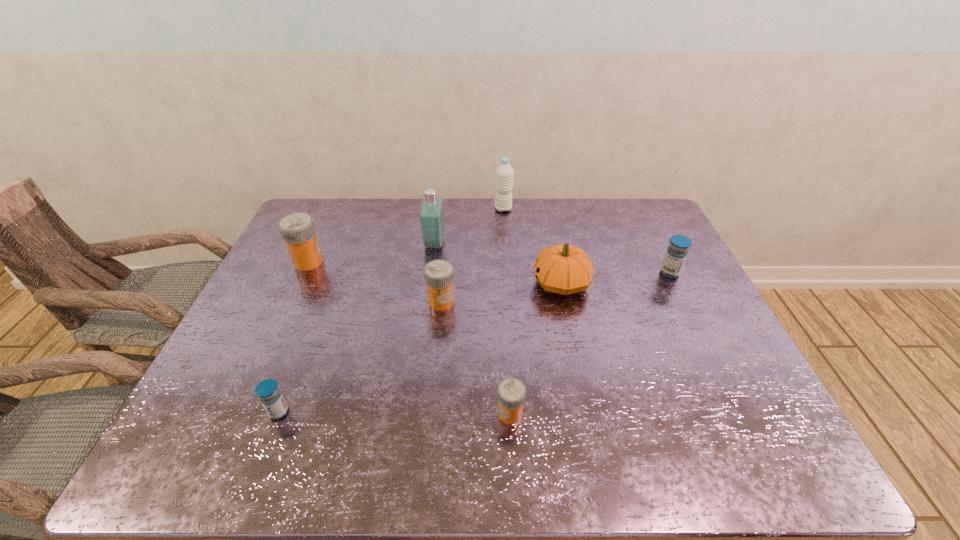
Locate an element on the screen. The height and width of the screenshot is (540, 960). the third nearest medicine is located at coordinates 439,274.

Locate an element on the screen. The height and width of the screenshot is (540, 960). the smaller blue medicine is located at coordinates (268, 392).

Locate an element on the screen. The width and height of the screenshot is (960, 540). the nearer blue medicine is located at coordinates (268, 392).

The image size is (960, 540). In order to click on the rightmost orange medicine in this screenshot , I will do `click(511, 391)`.

Find the location of a particular element. This screenshot has width=960, height=540. the smallest orange medicine is located at coordinates (511, 391).

This screenshot has width=960, height=540. Identify the location of vacant region located on the front of the farthest object. tap(506, 247).

Find the location of a particular element. The image size is (960, 540). vacant point located on the front label of the perfume is located at coordinates (510, 244).

I want to click on free location located on the label side of the farthest orange medicine, so click(x=352, y=262).

The height and width of the screenshot is (540, 960). Identify the location of vacant point located 0.390m on the side of the second object from right to left with the carved face. (398, 283).

I want to click on vacant area located on the side of the second object from right to left with the carved face, so click(x=491, y=283).